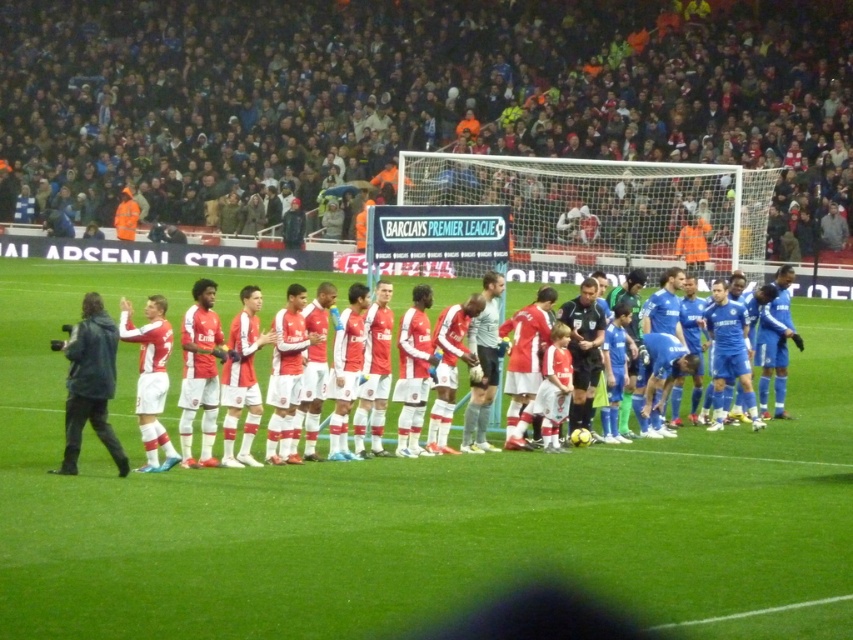
Question: Does matte red jersey at center have a smaller size compared to dark gray jacket at left?

Choices:
 (A) no
 (B) yes

Answer: (B)

Question: Among these points, which one is nearest to the camera?

Choices:
 (A) (102, 410)
 (B) (206, 300)

Answer: (A)

Question: Can you confirm if matte red jersey at center is positioned above dark gray jacket at left?

Choices:
 (A) yes
 (B) no

Answer: (A)

Question: Which of the following is the closest to the observer?

Choices:
 (A) (401, 339)
 (B) (115, 348)

Answer: (B)

Question: Is matte red jersey at center above dark gray jacket at left?

Choices:
 (A) yes
 (B) no

Answer: (A)

Question: Which object is closer to the camera taking this photo?

Choices:
 (A) dark gray jacket at left
 (B) matte red jersey at center

Answer: (A)